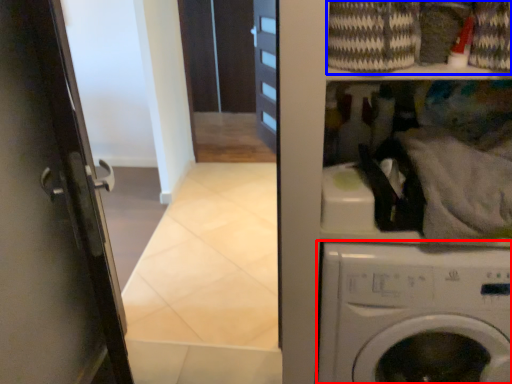
Question: Among these objects, which one is farthest to the camera, washing machine (highlighted by a red box) or laundry (highlighted by a blue box)?

Choices:
 (A) washing machine
 (B) laundry

Answer: (A)